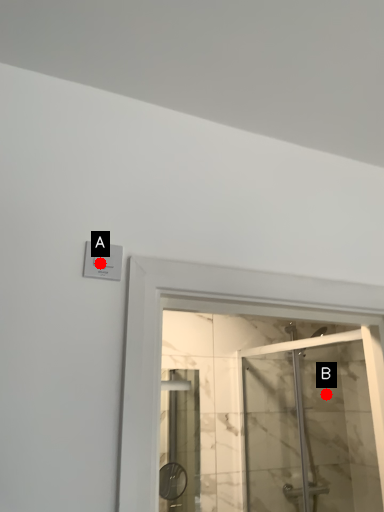
Question: Two points are circled on the image, labeled by A and B beside each circle. Which point appears closest to the camera in this image?

Choices:
 (A) A is closer
 (B) B is closer

Answer: (A)